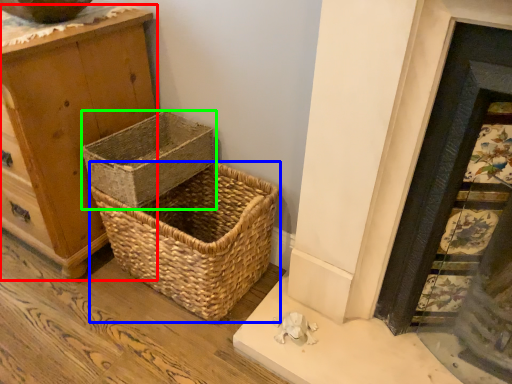
Question: Considering the real-world distances, which object is farthest from chest of drawers (highlighted by a red box)? picnic basket (highlighted by a blue box) or picnic basket (highlighted by a green box)?

Choices:
 (A) picnic basket
 (B) picnic basket

Answer: (A)